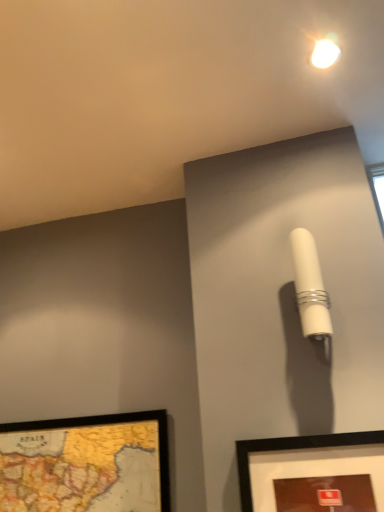
Question: Is the surface of matte black picture frame at lower right, which ranks as the 1th picture frame in front-to-back order, in direct contact with white glossy droplight at upper center?

Choices:
 (A) yes
 (B) no

Answer: (B)

Question: Can you confirm if matte black picture frame at lower right, which ranks as the 1th picture frame in front-to-back order, is bigger than white glossy droplight at upper center?

Choices:
 (A) yes
 (B) no

Answer: (A)

Question: Does matte black picture frame at lower right, the first picture frame when ordered from right to left, have a lesser width compared to white glossy droplight at upper center?

Choices:
 (A) no
 (B) yes

Answer: (B)

Question: Does matte black picture frame at lower right, which ranks as the 1th picture frame in front-to-back order, appear on the left side of white glossy droplight at upper center?

Choices:
 (A) yes
 (B) no

Answer: (A)

Question: From a real-world perspective, is matte black picture frame at lower right, placed as the 2th picture frame when sorted from left to right, positioned over white glossy droplight at upper center based on gravity?

Choices:
 (A) no
 (B) yes

Answer: (A)

Question: Considering the positions of matte black picture frame at lower right, the first picture frame when ordered from right to left, and white glossy droplight at upper center in the image, is matte black picture frame at lower right, the first picture frame when ordered from right to left, taller or shorter than white glossy droplight at upper center?

Choices:
 (A) tall
 (B) short

Answer: (A)

Question: Is matte black picture frame at lower right, placed as the 2th picture frame when sorted from left to right, wider or thinner than white glossy droplight at upper center?

Choices:
 (A) thin
 (B) wide

Answer: (A)

Question: Relative to white glossy droplight at upper center, is matte black picture frame at lower right, which ranks as the 1th picture frame in front-to-back order, in front or behind?

Choices:
 (A) front
 (B) behind

Answer: (A)

Question: Is point (244, 472) positioned closer to the camera than point (326, 44)?

Choices:
 (A) closer
 (B) farther

Answer: (A)

Question: Considering the positions of white glossy droplight at upper center and white matte cylindrical lamp at upper right in the image, is white glossy droplight at upper center taller or shorter than white matte cylindrical lamp at upper right?

Choices:
 (A) tall
 (B) short

Answer: (B)

Question: Is white glossy droplight at upper center inside or outside of white matte cylindrical lamp at upper right?

Choices:
 (A) inside
 (B) outside

Answer: (B)

Question: Visually, is white glossy droplight at upper center positioned to the left or to the right of white matte cylindrical lamp at upper right?

Choices:
 (A) right
 (B) left

Answer: (A)

Question: Is point (324, 59) closer or farther from the camera than point (306, 314)?

Choices:
 (A) farther
 (B) closer

Answer: (A)

Question: Relative to matte black picture frame at lower right, placed as the 2th picture frame when sorted from left to right, is white matte cylindrical lamp at upper right in front or behind?

Choices:
 (A) front
 (B) behind

Answer: (B)

Question: In terms of width, does white matte cylindrical lamp at upper right look wider or thinner when compared to matte black picture frame at lower right, which ranks as the 1th picture frame in front-to-back order?

Choices:
 (A) wide
 (B) thin

Answer: (A)